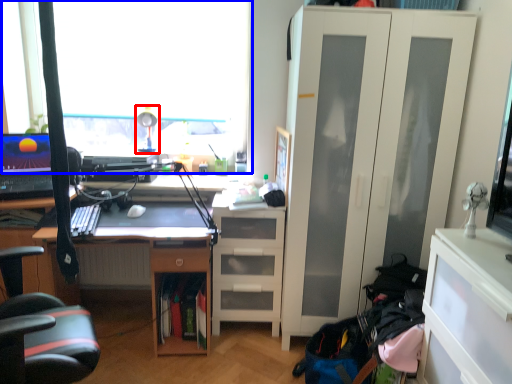
Question: Among these objects, which one is nearest to the camera, table lamp (highlighted by a red box) or window (highlighted by a blue box)?

Choices:
 (A) table lamp
 (B) window

Answer: (A)